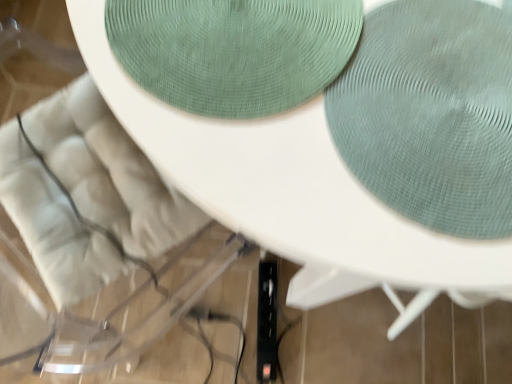
Question: Looking at the image, does white fabric swivel chair at upper left seem bigger or smaller compared to green textured placemat at upper center?

Choices:
 (A) big
 (B) small

Answer: (A)

Question: In the image, is white fabric swivel chair at upper left on the left side or the right side of green textured placemat at upper center?

Choices:
 (A) right
 (B) left

Answer: (B)

Question: Is white fabric swivel chair at upper left wider or thinner than green textured placemat at upper center?

Choices:
 (A) wide
 (B) thin

Answer: (A)

Question: Considering the positions of point (176, 97) and point (57, 190), is point (176, 97) closer or farther from the camera than point (57, 190)?

Choices:
 (A) farther
 (B) closer

Answer: (B)

Question: Considering the positions of green textured placemat at upper center and white fabric swivel chair at upper left in the image, is green textured placemat at upper center wider or thinner than white fabric swivel chair at upper left?

Choices:
 (A) thin
 (B) wide

Answer: (A)

Question: In terms of size, does green textured placemat at upper center appear bigger or smaller than white fabric swivel chair at upper left?

Choices:
 (A) small
 (B) big

Answer: (A)

Question: Do you think green textured placemat at upper center is within white fabric swivel chair at upper left, or outside of it?

Choices:
 (A) inside
 (B) outside

Answer: (B)